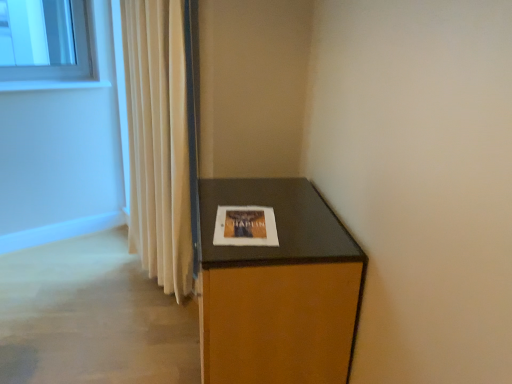
You are a GUI agent. You are given a task and a screenshot of the screen. Output one action in this format:
    pyautogui.click(x=<x>, y=<y>)
    Task: Click on the vacant area that is situated to the right of matte white picture frame at center
    The width and height of the screenshot is (512, 384).
    Given the screenshot: What is the action you would take?
    point(304,226)